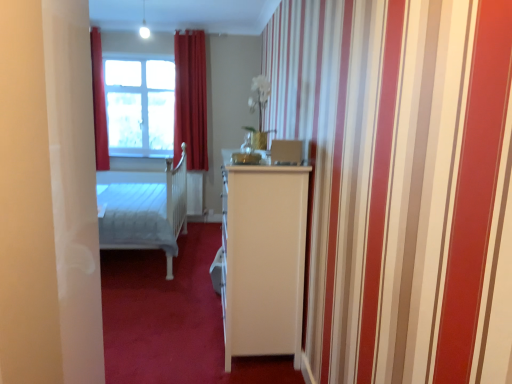
What do you see at coordinates (140, 107) in the screenshot? I see `white glass window at upper center` at bounding box center [140, 107].

The height and width of the screenshot is (384, 512). Find the location of `white glass window at upper center`. white glass window at upper center is located at coordinates (140, 107).

Measure the distance between velvet red curtain at center and camera.

A distance of 5.24 meters exists between velvet red curtain at center and camera.

Where is `velvet red curtain at center`? velvet red curtain at center is located at coordinates (190, 99).

The height and width of the screenshot is (384, 512). Describe the element at coordinates (190, 99) in the screenshot. I see `velvet red curtain at center` at that location.

You are a GUI agent. You are given a task and a screenshot of the screen. Output one action in this format:
    pyautogui.click(x=<x>, y=<y>)
    Task: Click on the white glass window at upper center
    This screenshot has width=512, height=384.
    Given the screenshot: What is the action you would take?
    pyautogui.click(x=140, y=107)

Based on their positions, is velvet red curtain at center located to the left or right of white glass window at upper center?

Based on their positions, velvet red curtain at center is located to the right of white glass window at upper center.

Considering the positions of objects velvet red curtain at center and white glass window at upper center in the image provided, who is behind, velvet red curtain at center or white glass window at upper center?

white glass window at upper center is further from the camera.

Between point (187, 147) and point (132, 131), which one is positioned in front?

The point (187, 147) is closer to the camera.

From the image's perspective, relative to white glass window at upper center, is velvet red curtain at center above or below?

velvet red curtain at center is below white glass window at upper center.

From a real-world perspective, which is physically above, velvet red curtain at center or white glass window at upper center?

From a 3D spatial view, velvet red curtain at center is above.

Does velvet red curtain at center have a lesser width compared to white glass window at upper center?

No, velvet red curtain at center is not thinner than white glass window at upper center.

From the picture: Considering the sizes of objects velvet red curtain at center and white glass window at upper center in the image provided, who is shorter, velvet red curtain at center or white glass window at upper center?

white glass window at upper center is shorter.

Does velvet red curtain at center have a larger size compared to white glass window at upper center?

Yes.

Is white glass window at upper center completely or partially inside velvet red curtain at center?

No, velvet red curtain at center does not contain white glass window at upper center.

Is velvet red curtain at center directly adjacent to white glass window at upper center?

velvet red curtain at center is not next to white glass window at upper center, and they're not touching.

Is velvet red curtain at center looking in the opposite direction of white glass window at upper center?

velvet red curtain at center is not turned away from white glass window at upper center.

In order to click on curtain below the white glass window at upper center (from the image's perspective) in this screenshot , I will do `click(190, 99)`.

Which is more to the left, white glass window at upper center or velvet red curtain at center?

From the viewer's perspective, white glass window at upper center appears more on the left side.

In the scene shown: Which object is further away from the camera taking this photo, white glass window at upper center or velvet red curtain at center?

white glass window at upper center is further from the camera.

Which is nearer, (x=120, y=79) or (x=175, y=85)?

Point (x=175, y=85)

From the image's perspective, which one is positioned lower, white glass window at upper center or velvet red curtain at center?

velvet red curtain at center appears lower in the image.

From a real-world perspective, is white glass window at upper center beneath velvet red curtain at center?

Indeed, from a real-world perspective, white glass window at upper center is positioned beneath velvet red curtain at center.

Looking at this image, can you confirm if white glass window at upper center is wider than velvet red curtain at center?

Incorrect, the width of white glass window at upper center does not surpass that of velvet red curtain at center.

In terms of height, does white glass window at upper center look taller or shorter compared to velvet red curtain at center?

In the image, white glass window at upper center appears to be shorter than velvet red curtain at center.

Considering the relative sizes of white glass window at upper center and velvet red curtain at center in the image provided, is white glass window at upper center bigger than velvet red curtain at center?

Actually, white glass window at upper center might be smaller than velvet red curtain at center.

Can we say white glass window at upper center lies outside velvet red curtain at center?

Yes, white glass window at upper center is located beyond the bounds of velvet red curtain at center.

Looking at this image, is white glass window at upper center beside velvet red curtain at center?

white glass window at upper center is not next to velvet red curtain at center, and they're not touching.

Is white glass window at upper center oriented towards velvet red curtain at center?

No, white glass window at upper center does not turn towards velvet red curtain at center.

What's the angular difference between white glass window at upper center and velvet red curtain at center's facing directions?

There is a 1.38-degree angle between the facing directions of white glass window at upper center and velvet red curtain at center.

Measure the distance between white glass window at upper center and velvet red curtain at center.

The distance of white glass window at upper center from velvet red curtain at center is 23.80 inches.

Identify the location of curtain that appears on the right of white glass window at upper center. (190, 99).

You are a GUI agent. You are given a task and a screenshot of the screen. Output one action in this format:
    pyautogui.click(x=<x>, y=<y>)
    Task: Click on the curtain positioned vertically above the white glass window at upper center (from a real-world perspective)
    
    Given the screenshot: What is the action you would take?
    pyautogui.click(x=190, y=99)

Locate an element on the screen. Image resolution: width=512 pixels, height=384 pixels. window lying on the left of velvet red curtain at center is located at coordinates (140, 107).